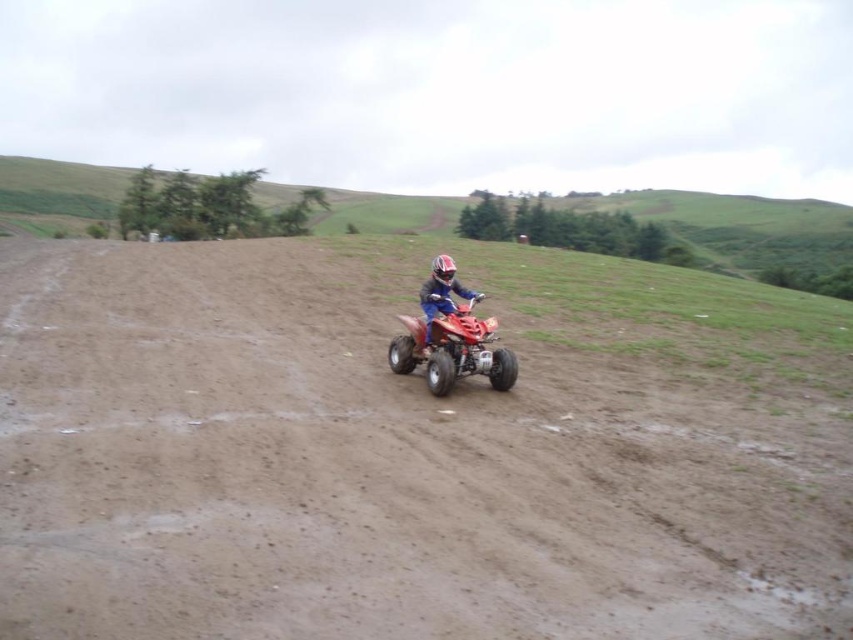
Question: Is brown sandy terrain at center closer to camera compared to shiny red quad bike at center?

Choices:
 (A) yes
 (B) no

Answer: (A)

Question: Which point is closer to the camera taking this photo?

Choices:
 (A) [450, 285]
 (B) [614, 316]
 (C) [444, 282]

Answer: (C)

Question: Which point is closer to the camera taking this photo?

Choices:
 (A) (469, 304)
 (B) (447, 408)

Answer: (B)

Question: Is the position of brown sandy terrain at center less distant than that of matte orange quad bike at center?

Choices:
 (A) no
 (B) yes

Answer: (B)

Question: Estimate the real-world distances between objects in this image. Which object is farther from the brown sandy terrain at center?

Choices:
 (A) shiny red quad bike at center
 (B) matte orange quad bike at center

Answer: (B)

Question: From the image, what is the correct spatial relationship of brown sandy terrain at center in relation to matte orange quad bike at center?

Choices:
 (A) right
 (B) left

Answer: (B)